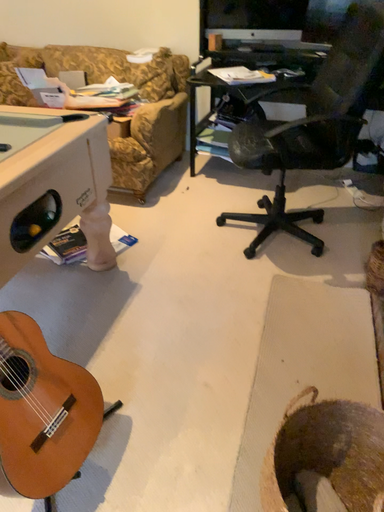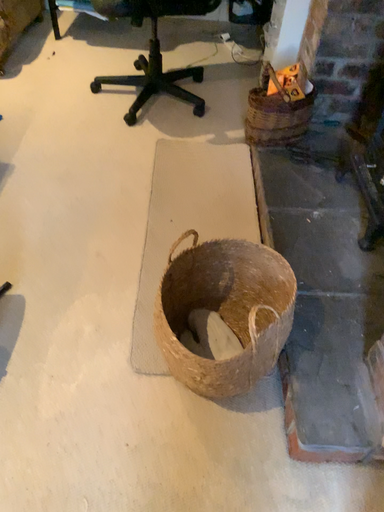
Question: How did the camera likely rotate when shooting the video?

Choices:
 (A) rotated left
 (B) rotated right

Answer: (B)